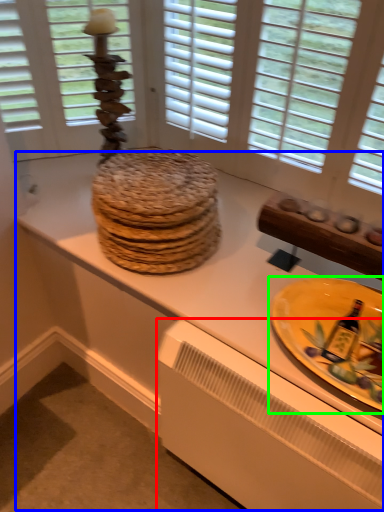
Question: Which is nearer to the radiator (highlighted by a red box)? counter top (highlighted by a blue box) or plate (highlighted by a green box).

Choices:
 (A) counter top
 (B) plate

Answer: (A)